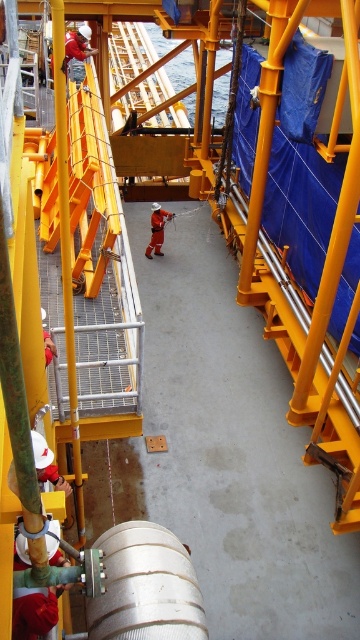
You are a technician on an offshore oil rig. You need to place a safety barrier 4 meters away from your current position to secure the area around the silver metallic barrel at center. Based on the scene, can you position the barrier at the correct distance?

The silver metallic barrel at center is 3.96 meters from viewer. Since the required distance is 4 meters, the technician can position the barrier slightly beyond the barrel to meet the requirement.

You are a safety inspector on the offshore oil rig. You need to place a new safety sign that must be larger than both the silver metallic barrel at center and the orange fabric construction worker at center. Is this possible given their sizes?

The silver metallic barrel at center is smaller than the orange fabric construction worker at center. Therefore, the safety sign needs to be larger than the orange fabric construction worker at center to satisfy both requirements.